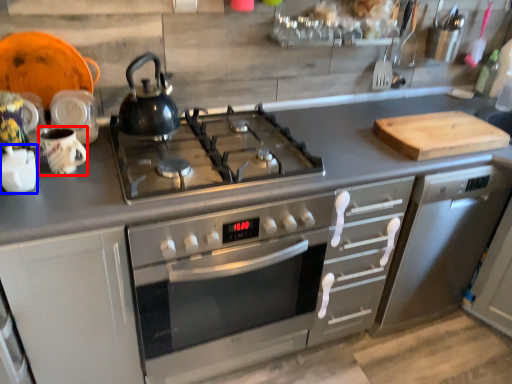
Question: Which point is further to the camera, mug (highlighted by a red box) or appliance (highlighted by a blue box)?

Choices:
 (A) mug
 (B) appliance

Answer: (A)